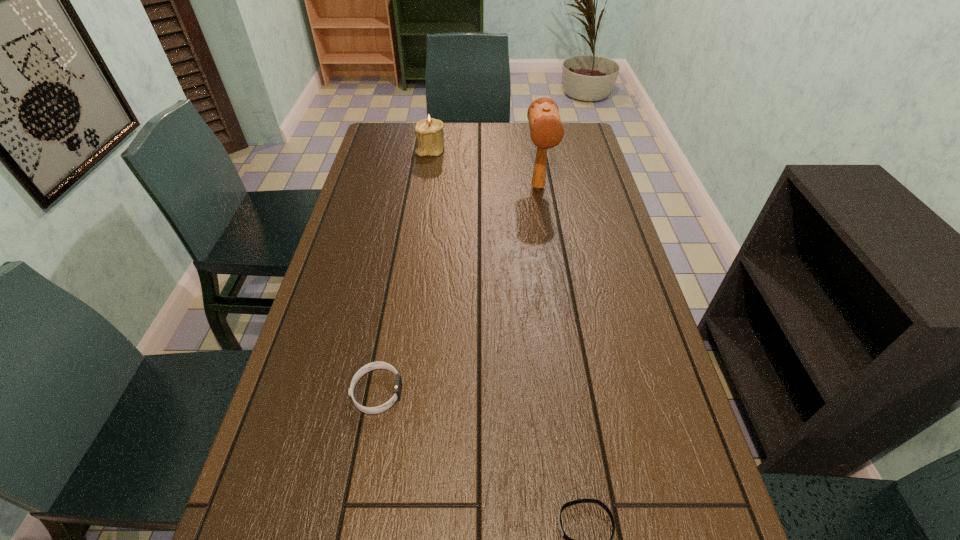
Find the location of a particular element. This screenshot has width=960, height=540. the third nearest object is located at coordinates click(546, 130).

Find the location of a particular element. This screenshot has width=960, height=540. the tallest object is located at coordinates (546, 130).

Where is `candle_holder`? candle_holder is located at coordinates (429, 133).

In order to click on the third shortest object in this screenshot , I will do `click(429, 133)`.

Locate an element on the screen. Image resolution: width=960 pixels, height=540 pixels. the third tallest object is located at coordinates (374, 365).

The height and width of the screenshot is (540, 960). Identify the location of the left wristband. (374, 365).

Find the location of a particular element. The height and width of the screenshot is (540, 960). free region located on the strike surface of the tallest object is located at coordinates (551, 270).

Image resolution: width=960 pixels, height=540 pixels. I want to click on vacant point located on the right of the candle_holder, so (462, 150).

Locate an element on the screen. This screenshot has height=540, width=960. vacant space located on the outer surface of the taller wristband is located at coordinates (456, 392).

In order to click on object that is positioned at the far edge in this screenshot , I will do `click(429, 133)`.